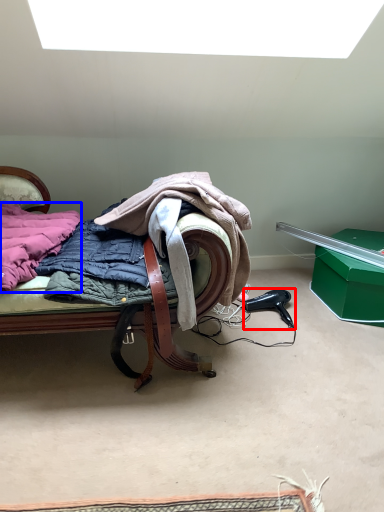
Question: Which object is further to the camera taking this photo, hair drier (highlighted by a red box) or underclothes (highlighted by a blue box)?

Choices:
 (A) hair drier
 (B) underclothes

Answer: (A)